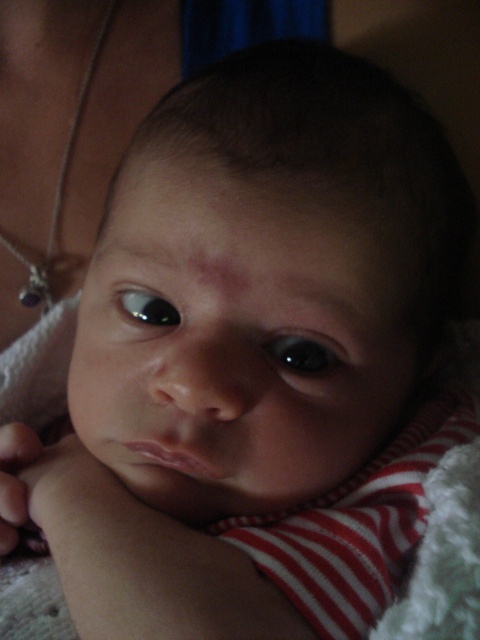
Question: Which object appears closest to the camera in this image?

Choices:
 (A) glossy black eye at center
 (B) black glossy eye at center

Answer: (B)

Question: Which of the following is the closest to the observer?

Choices:
 (A) (135, 310)
 (B) (324, 353)

Answer: (B)

Question: Can you confirm if black glossy eye at center is positioned to the left of glossy black eye at center?

Choices:
 (A) yes
 (B) no

Answer: (B)

Question: Can you confirm if black glossy eye at center is smaller than glossy black eye at center?

Choices:
 (A) yes
 (B) no

Answer: (A)

Question: Which of the following is the closest to the observer?

Choices:
 (A) black glossy eye at center
 (B) glossy black eye at center

Answer: (A)

Question: Does black glossy eye at center have a larger size compared to glossy black eye at center?

Choices:
 (A) yes
 (B) no

Answer: (B)